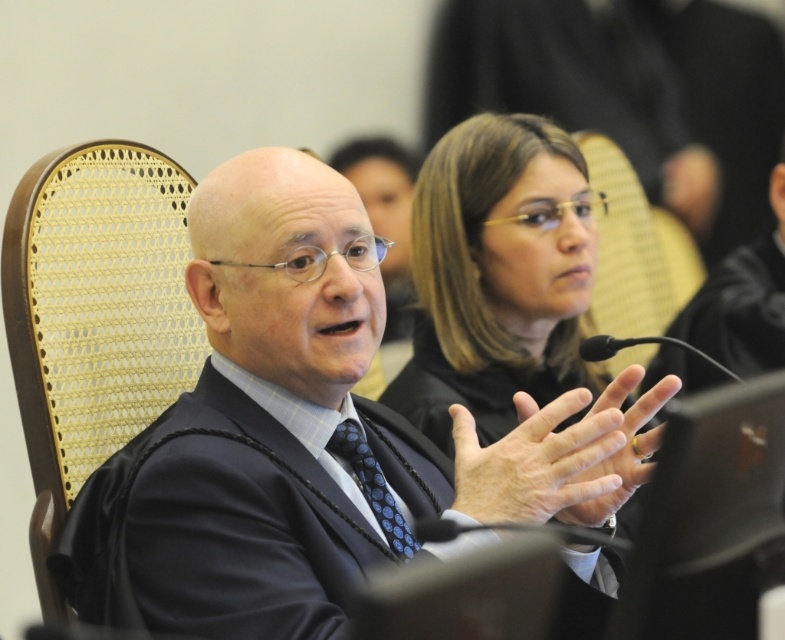
Question: Which object appears farthest from the camera in this image?

Choices:
 (A) light skin tone hand at center
 (B) matte black robe at center
 (C) blue dotted fabric tie at center
 (D) gold ring at center

Answer: (B)

Question: Can you confirm if light skin tone hand at center is positioned to the right of blue dotted fabric tie at center?

Choices:
 (A) no
 (B) yes

Answer: (B)

Question: Which point is closer to the camera taking this photo?

Choices:
 (A) (601, 417)
 (B) (323, 408)
 (C) (453, 378)
 (D) (676, 380)

Answer: (A)

Question: Which point is farther to the camera?

Choices:
 (A) matte black robe at center
 (B) blue dotted fabric tie at center
 (C) gold ring at center
 (D) matte black suit at center

Answer: (A)

Question: Does woven cane chair at left lie in front of blue dotted fabric tie at center?

Choices:
 (A) yes
 (B) no

Answer: (A)

Question: Does matte black robe at center appear on the left side of gold ring at center?

Choices:
 (A) yes
 (B) no

Answer: (A)